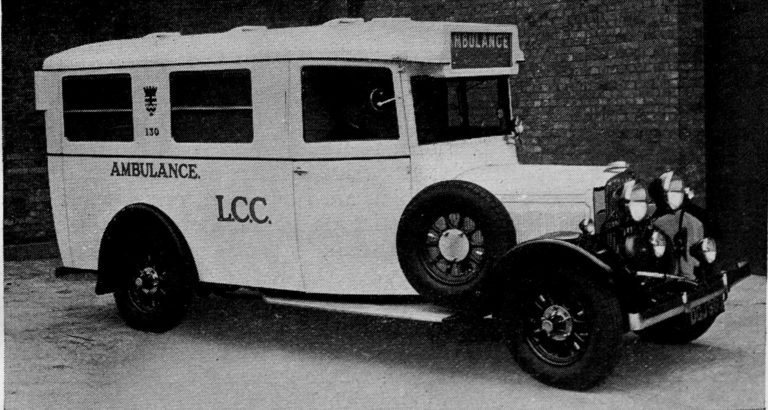
You are a GUI agent. You are given a task and a screenshot of the screen. Output one action in this format:
    pyautogui.click(x=<x>, y=<y>)
    Task: Click on the brick wall
    
    Given the screenshot: What is the action you would take?
    pyautogui.click(x=581, y=68), pyautogui.click(x=12, y=81)